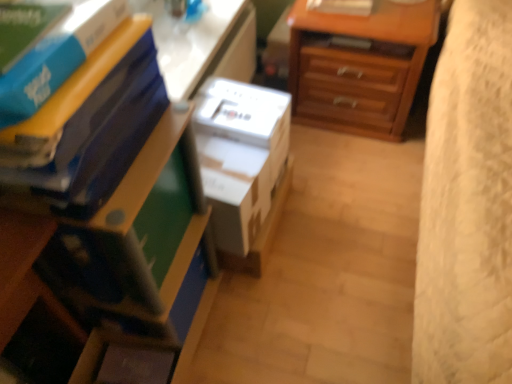
Question: In terms of size, does blue matte book at upper left, the 3th paperback book when ordered from back to front, appear bigger or smaller than white plastic table at upper center?

Choices:
 (A) big
 (B) small

Answer: (B)

Question: From the image's perspective, relative to white plastic table at upper center, is blue matte book at upper left, the 3th paperback book when ordered from back to front, above or below?

Choices:
 (A) below
 (B) above

Answer: (A)

Question: Which of these objects is positioned farthest from the wooden chest of drawers at upper right?

Choices:
 (A) white plastic table at upper center
 (B) matte plastic nightstand at lower left
 (C) blue matte book at upper left, which appears as the 3th paperback book when viewed from the front
 (D) white cardboard box at center
 (E) matte blue paperback book at left, the second paperback book in the back-to-front sequence

Answer: (C)

Question: Based on their relative distances, which object is farther from the blue matte book at upper left, which appears as the 3th paperback book when viewed from the front?

Choices:
 (A) matte blue paperback book at left, which ranks as the second paperback book in front-to-back order
 (B) matte plastic nightstand at lower left
 (C) white plastic table at upper center
 (D) blue matte book at upper left, the 1th paperback book in the front-to-back sequence
 (E) white cardboard box at center

Answer: (C)